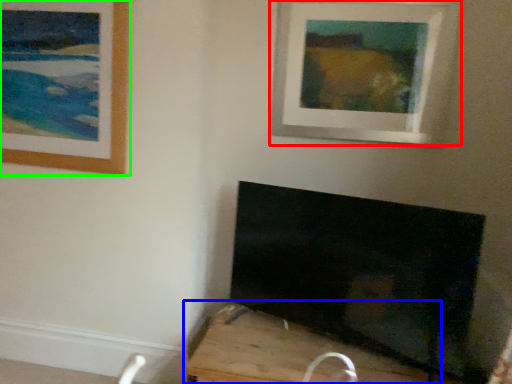
Question: Which object is positioned closest to picture frame (highlighted by a red box)? Select from furniture (highlighted by a blue box) and picture frame (highlighted by a green box).

Choices:
 (A) furniture
 (B) picture frame

Answer: (B)